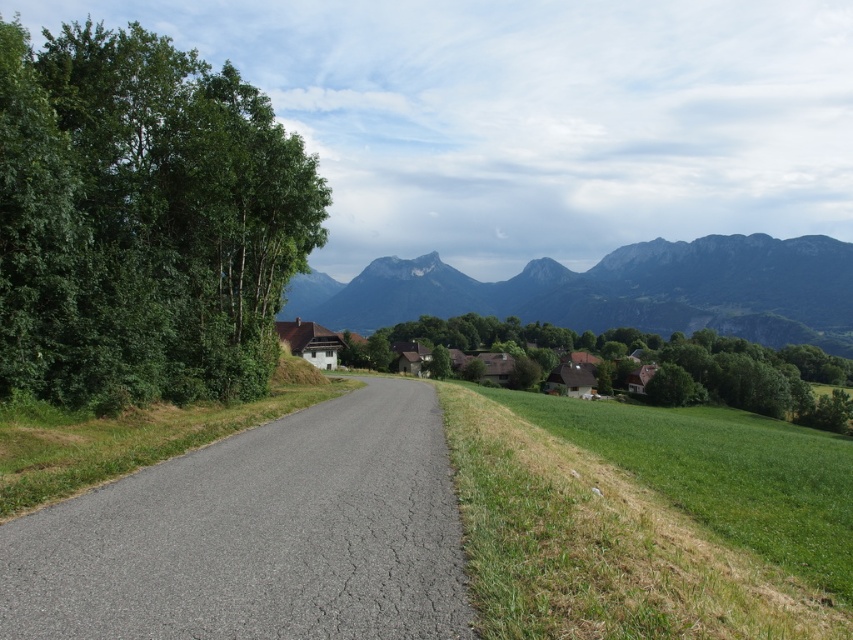
Question: Which of the following is the farthest from the observer?

Choices:
 (A) green leafy tree at left
 (B) green rocky mountain at upper center

Answer: (B)

Question: Is green rocky mountain at upper center wider than white wooden houses at center?

Choices:
 (A) yes
 (B) no

Answer: (A)

Question: Which point is farther to the camera?

Choices:
 (A) green rocky mountain at upper center
 (B) white wooden houses at center

Answer: (B)

Question: Is green leafy tree at left positioned behind white wooden houses at center?

Choices:
 (A) yes
 (B) no

Answer: (B)

Question: Is green leafy tree at left to the left of white wooden houses at center from the viewer's perspective?

Choices:
 (A) no
 (B) yes

Answer: (B)

Question: Which point appears farthest from the camera in this image?

Choices:
 (A) (376, 340)
 (B) (523, 268)

Answer: (B)